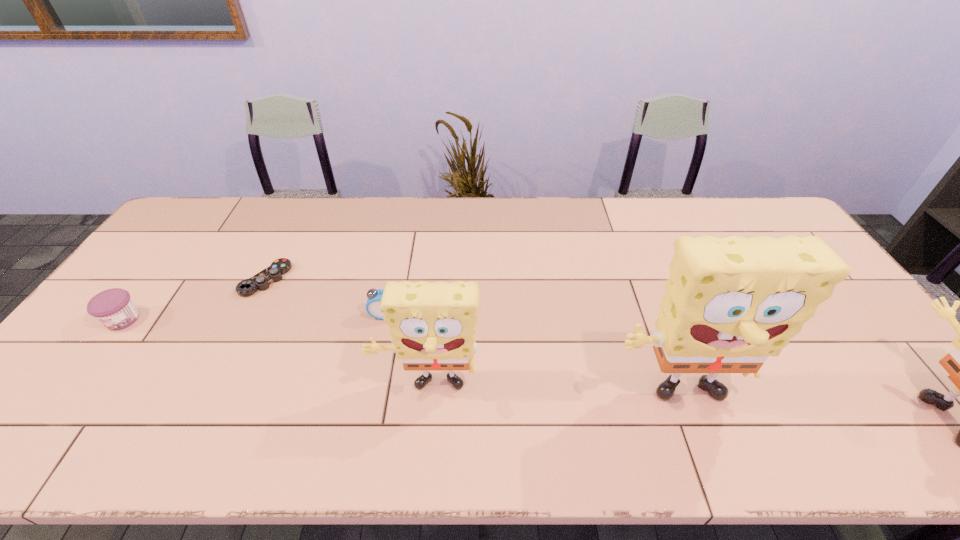
In order to click on free space for a new sponge on the left in this screenshot , I will do `click(190, 378)`.